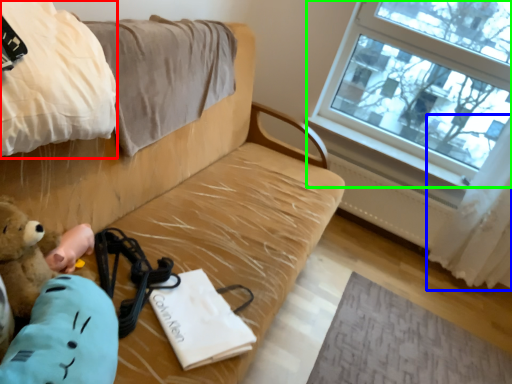
Question: Estimate the real-world distances between objects in this image. Which object is farther from blanket (highlighted by a red box), curtain (highlighted by a blue box) or window (highlighted by a green box)?

Choices:
 (A) curtain
 (B) window

Answer: (A)